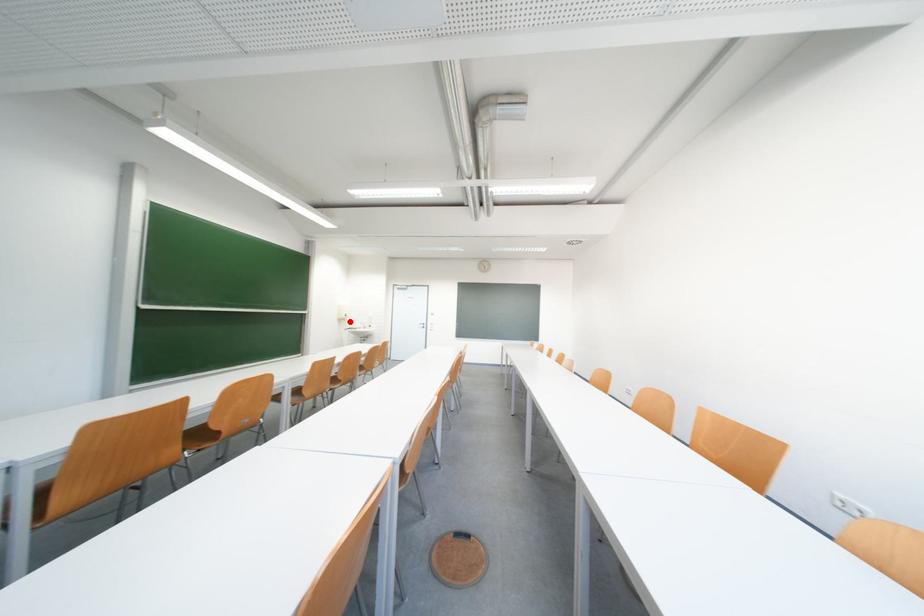
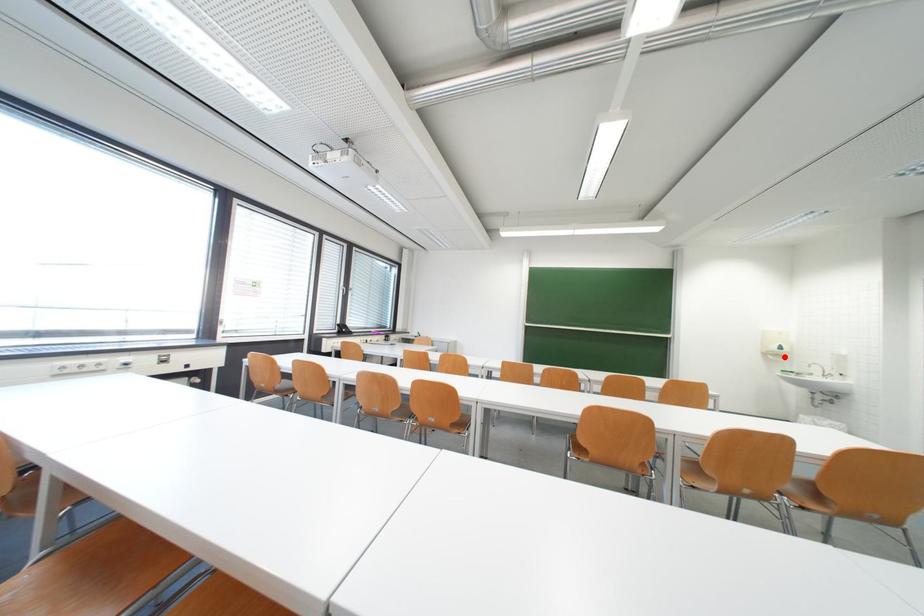
I am providing you with two images of the same scene from different viewpoints. A red point is marked on the first image and another point is marked on the second image. Are the points marked in image1 and image2 representing the same 3D position?

Yes